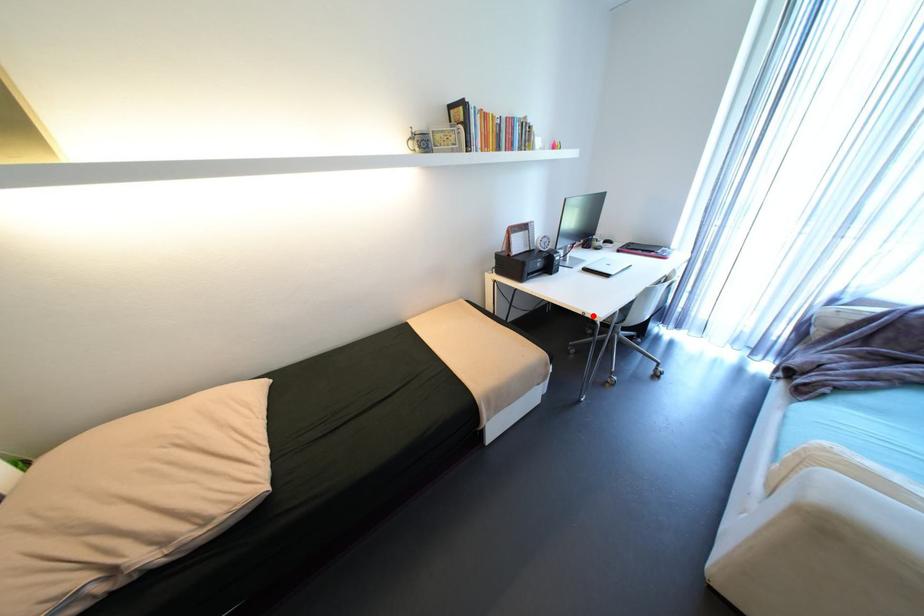
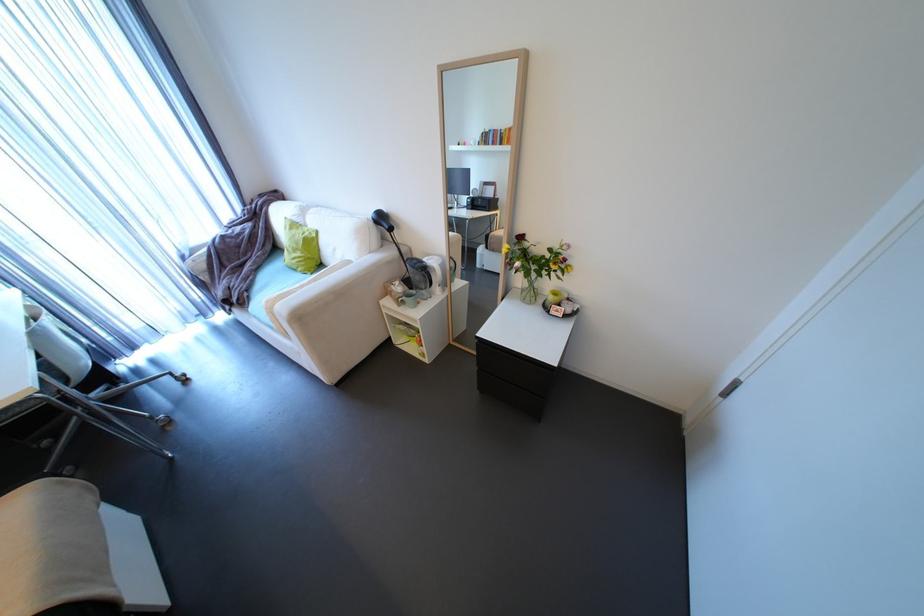
In the second image, find the point that corresponds to the highlighted location in the first image.

(7, 408)